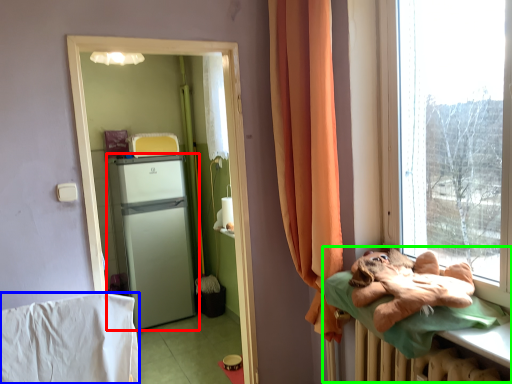
Question: Based on their relative distances, which object is farther from refrigerator (highlighted by a red box)? Choose from blanket (highlighted by a blue box) and hospital bed (highlighted by a green box).

Choices:
 (A) blanket
 (B) hospital bed

Answer: (B)